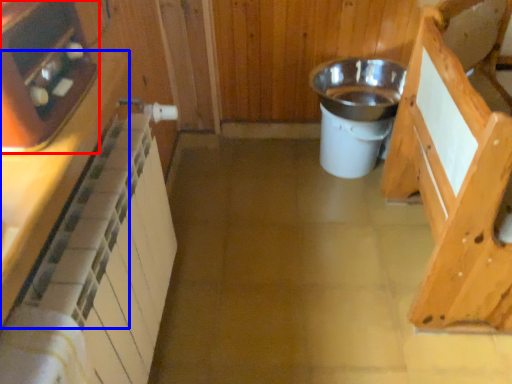
Question: Which of the following is the farthest to the observer, appliance (highlighted by a red box) or cabinetry (highlighted by a blue box)?

Choices:
 (A) appliance
 (B) cabinetry

Answer: (A)